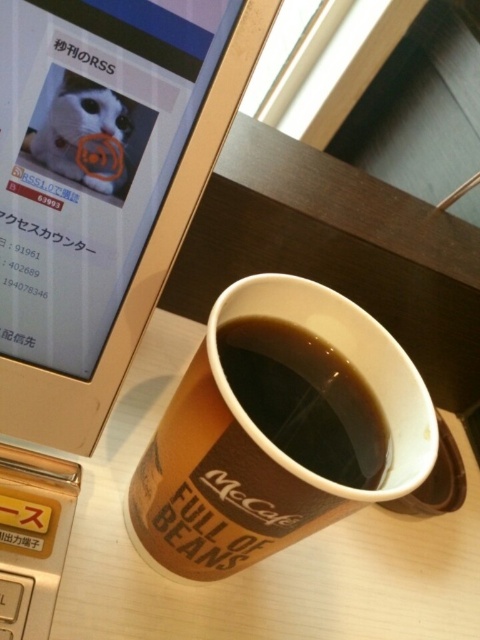
You are a barista holding a 12 inch long spatula. You need to place it on the desk without touching the brown paper cup at center. Is the desk big enough for this?

The brown paper cup at center and viewer are 13.39 inches apart. Since the spatula is 12 inches long, it can be placed on the desk without touching the cup as there is enough space between them.

You are organizing a small meeting at your office and need to place both the brown paper cup at center and the black paper cup at center on a narrow shelf. Which cup should you place on the left side to match the current arrangement?

The brown paper cup at center should be placed on the left side because it is positioned on the left side of the black paper cup at center in the current arrangement.

You are a barista working at a cafe and you see the brown paper cup at center and the black paper cup at center. Which cup is closer to the bottom edge of the table?

The brown paper cup at center is located below the black paper cup at center, so the brown paper cup at center is closer to the bottom edge of the table.